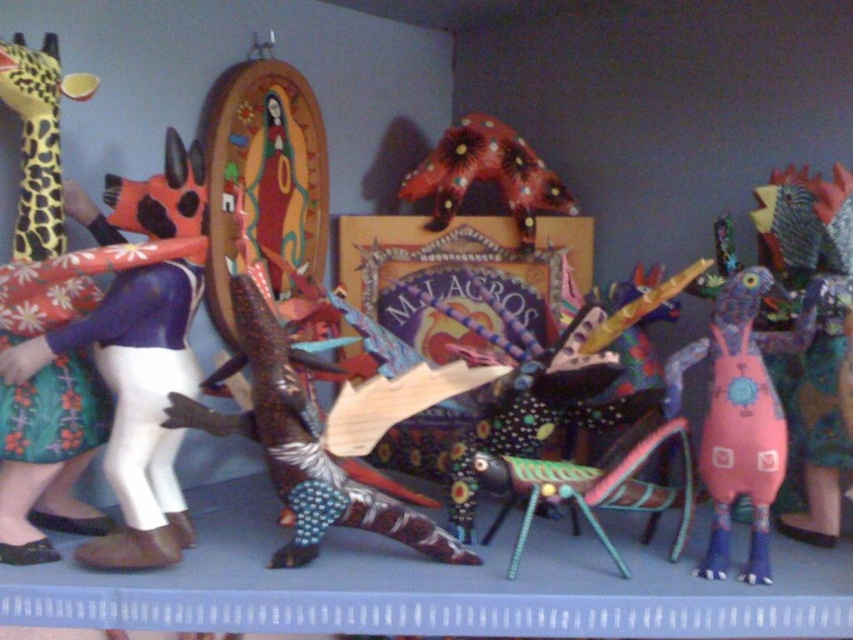
Question: Which object is positioned closest to the matte yellow giraffe at left?

Choices:
 (A) pink fabric bird at right
 (B) wooden lizard at center

Answer: (B)

Question: Can you confirm if matte purple fabric doll at left is positioned to the right of pink fabric bird at right?

Choices:
 (A) yes
 (B) no

Answer: (B)

Question: Which point is closer to the camera?

Choices:
 (A) matte yellow giraffe at left
 (B) pink fabric bird at right
 (C) wooden lizard at center
 (D) matte purple fabric doll at left

Answer: (A)

Question: Is matte yellow giraffe at left to the right of wooden lizard at center from the viewer's perspective?

Choices:
 (A) no
 (B) yes

Answer: (A)

Question: Does matte purple fabric doll at left have a lesser width compared to pink fabric bird at right?

Choices:
 (A) yes
 (B) no

Answer: (B)

Question: Which object is positioned closest to the matte purple fabric doll at left?

Choices:
 (A) wooden lizard at center
 (B) pink fabric bird at right
 (C) matte yellow giraffe at left

Answer: (C)